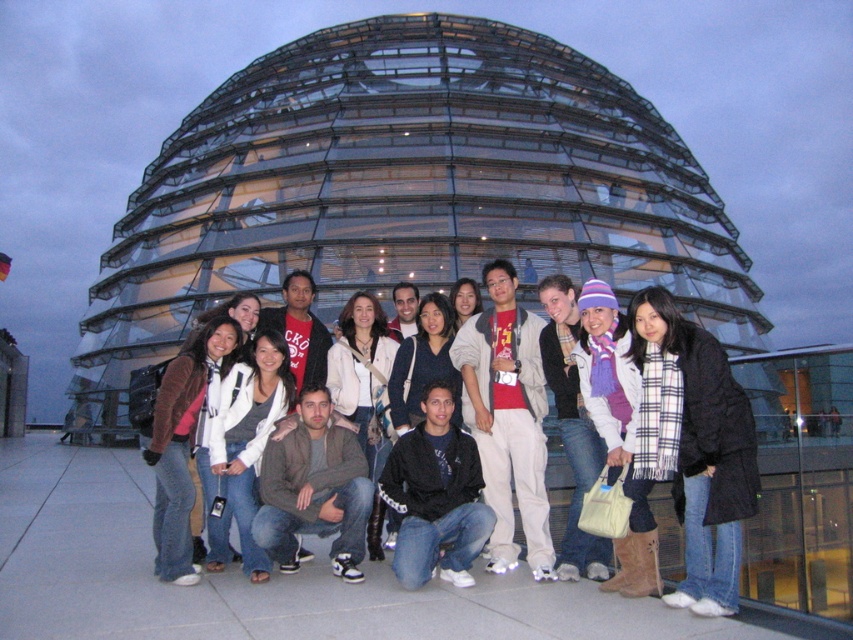
You are standing in front of the Reichstag dome and want to take a photo of two specific points in the scene. The first point is at coordinates point (508, 312) and the second is at point (236, 424). Which point is closer to you?

Point (508, 312) is further to the viewer than point (236, 424). Therefore, the second point at (236, 424) is closer to you.

You are a photographer trying to capture a clear shot of the Reichstag dome in Berlin. You notice two people in the foreground wearing a light gray cotton jacket at center and a white knit sweater at center. Which clothing item is positioned higher in the frame to avoid blocking the dome?

The light gray cotton jacket at center is much taller than the white knit sweater at center, so it is positioned higher and would block the view of the dome more. To avoid blocking the dome, the photographer should adjust the position so the light gray cotton jacket at center is moved back or lower.